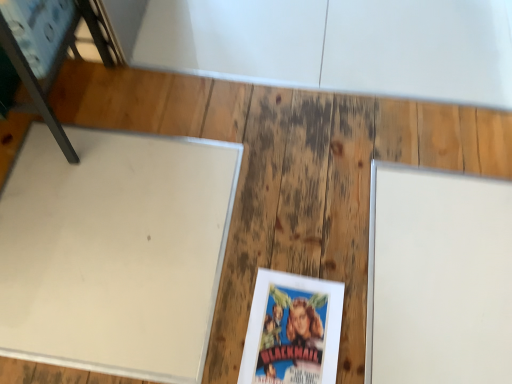
In order to click on vacant space to the left of white matte board at right in this screenshot , I will do `click(284, 258)`.